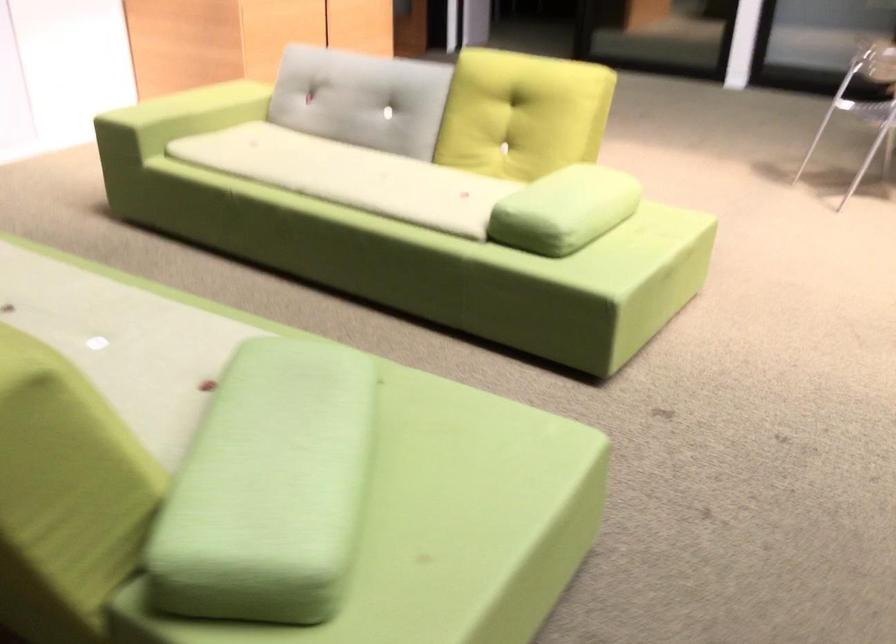
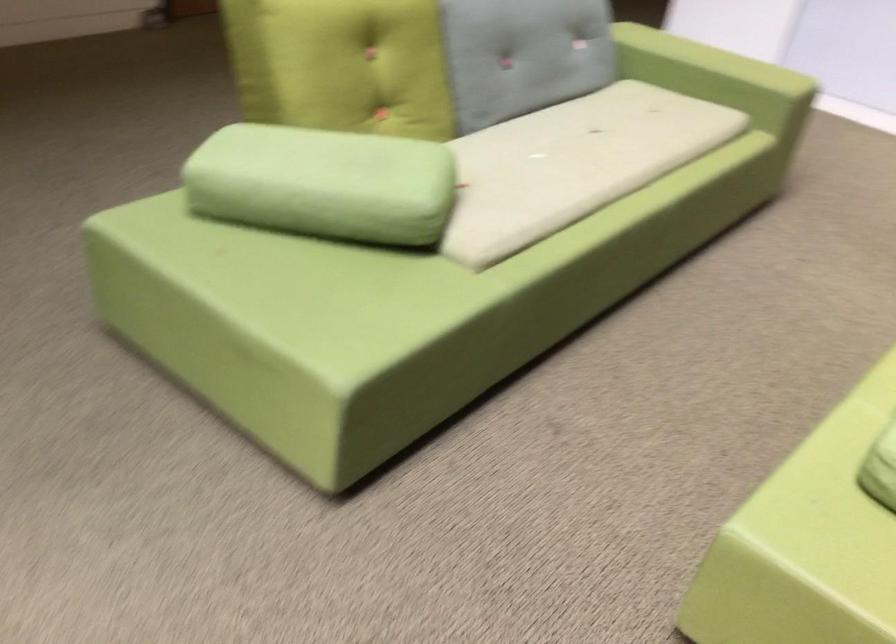
Where in the second image is the point corresponding to point 152,317 from the first image?

(572, 164)